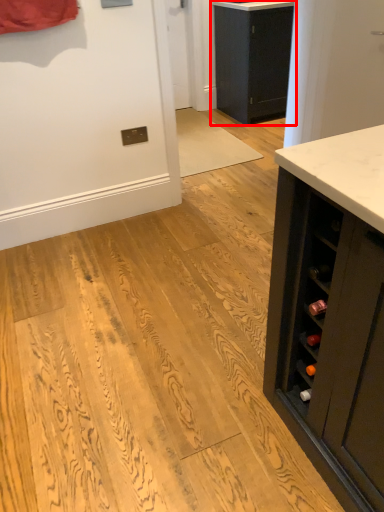
Question: Observing the image, what is the correct spatial positioning of cabinetry (annotated by the red box) in reference to counter top?

Choices:
 (A) left
 (B) right

Answer: (B)